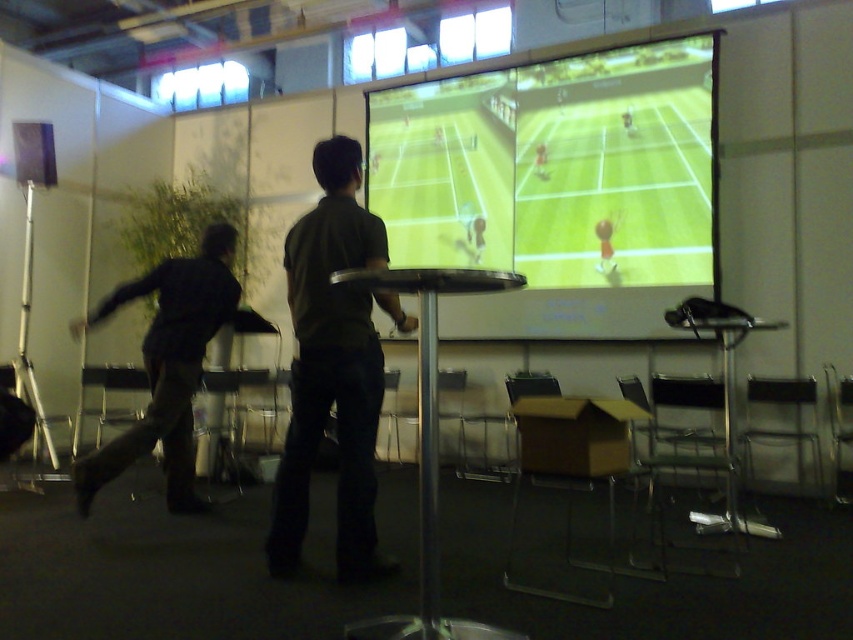
Question: Is green matte tennis court at center thinner than black matte pants at left?

Choices:
 (A) yes
 (B) no

Answer: (B)

Question: Based on their relative distances, which object is nearer to the green matte tennis court at center?

Choices:
 (A) black matte pants at left
 (B) dark green shirt at center

Answer: (A)

Question: Estimate the real-world distances between objects in this image. Which object is closer to the green matte tennis court at center?

Choices:
 (A) dark green shirt at center
 (B) black matte pants at left

Answer: (B)

Question: Which is nearer to the black matte pants at left?

Choices:
 (A) dark green shirt at center
 (B) green matte tennis court at center

Answer: (A)

Question: Can you confirm if green matte tennis court at center is bigger than dark green shirt at center?

Choices:
 (A) yes
 (B) no

Answer: (A)

Question: Is dark green shirt at center below black matte pants at left?

Choices:
 (A) no
 (B) yes

Answer: (A)